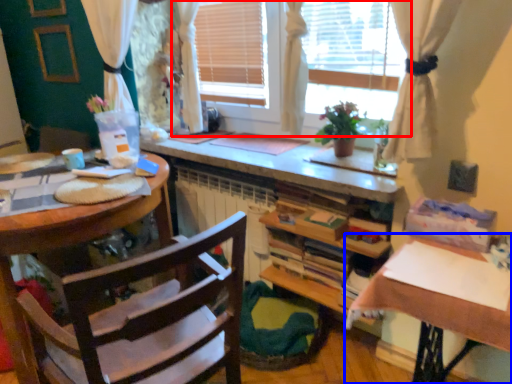
Question: Which object appears closest to the camera in this image, window (highlighted by a red box) or table (highlighted by a blue box)?

Choices:
 (A) window
 (B) table

Answer: (B)